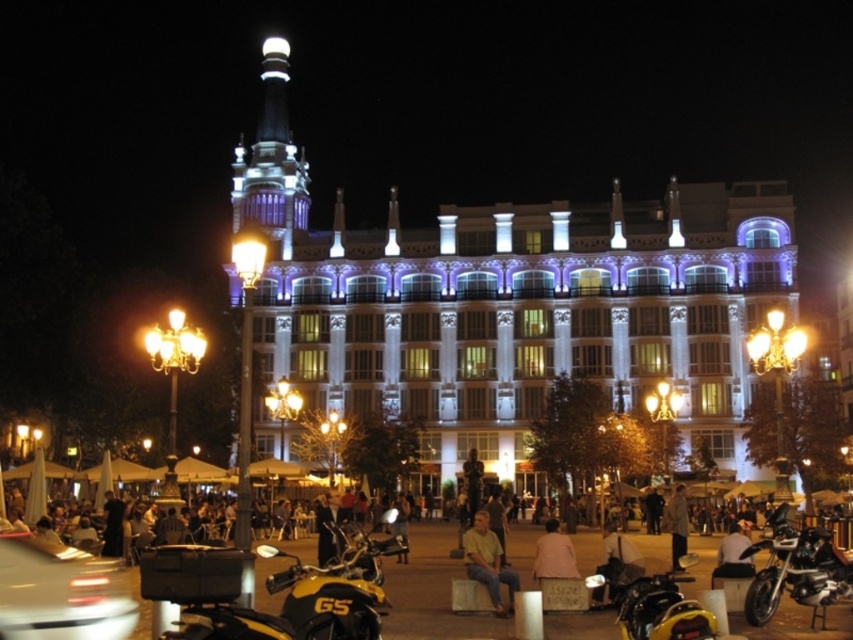
You are a delivery person who needs to place a package between the yellow matte motorcycle at lower center and the light brown leather jacket at lower center. The package requires a space of 3 meters. Is there enough space between them?

The distance between the yellow matte motorcycle at lower center and the light brown leather jacket at lower center is 3.27 meters, which is more than the required 3 meters. Therefore, there is enough space to place the package between them.

You are a delivery person who needs to park your 20 feet long truck between the shiny black motorcycle at lower right and the yellow matte motorcycle at lower center. Can you fit your truck in the space between them?

The distance between the shiny black motorcycle at lower right and the yellow matte motorcycle at lower center is 24.05 feet. Since the truck is 20 feet long, it can fit in the space between them as there is enough room.